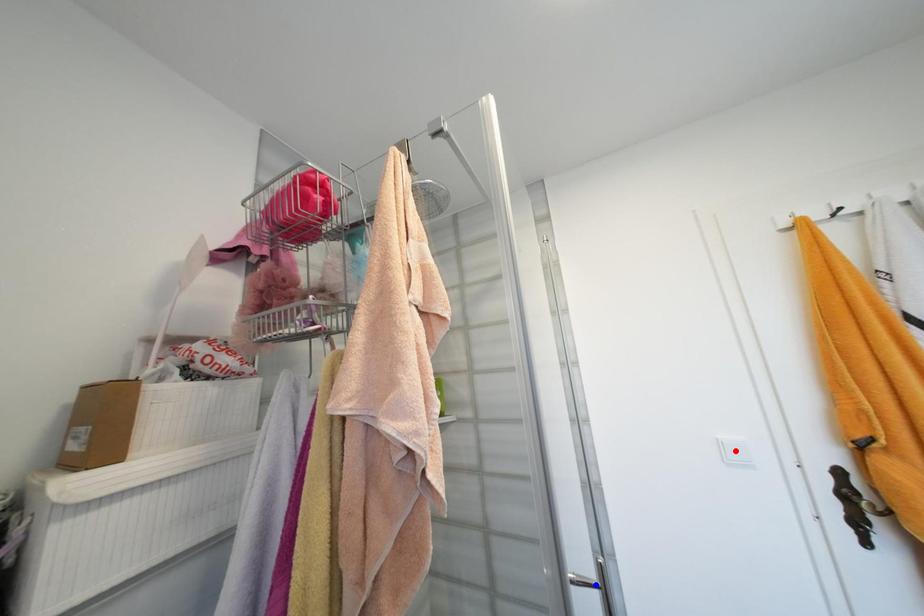
Question: In the image, two points are highlighted. Which point is nearer to the camera? Reply with the corresponding letter.

Choices:
 (A) blue point
 (B) red point

Answer: (A)